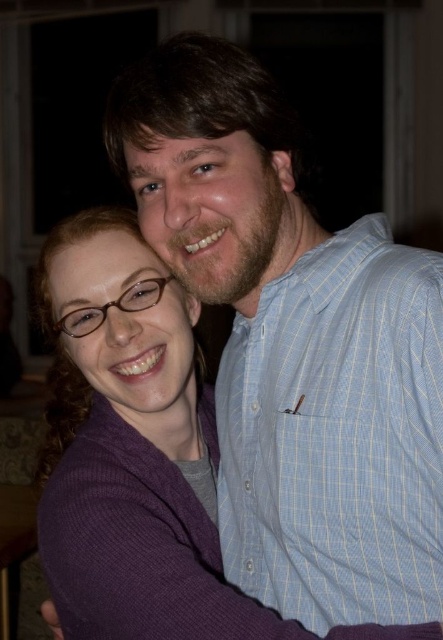
You are a photographer trying to capture a candid shot of the light blue striped shirt at center and the blue plaid shirt at center. Which one is closer to the camera?

The light blue striped shirt at center is behind the blue plaid shirt at center, so the blue plaid shirt at center is closer to the camera.

You are organizing a clothing donation drive and need to determine which shirt is more suitable for a child. Given the blue plaid shirt at center and the light blue striped shirt at center, which one is smaller in size?

The light blue striped shirt at center is smaller in size than the blue plaid shirt at center, so it would be more suitable for a child.